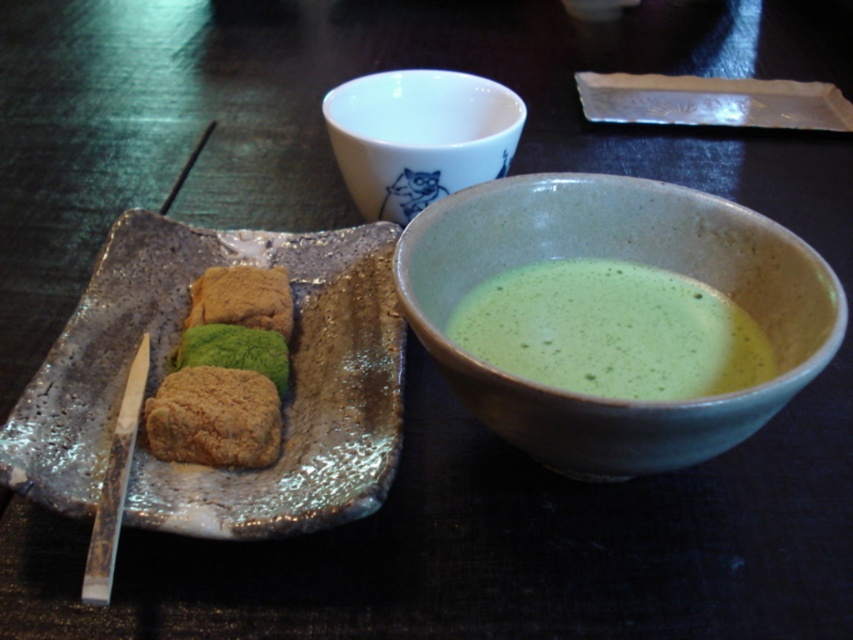
Question: Considering the real-world distances, which object is farthest from the matte ceramic bowl at center?

Choices:
 (A) brown crumbly pastry at center
 (B) green matte soup at center
 (C) white ceramic cup at upper center
 (D) green matte matcha tea cake at center

Answer: (C)

Question: Which point appears farthest from the camera in this image?

Choices:
 (A) (375, 269)
 (B) (585, 316)
 (C) (450, 100)
 (D) (247, 349)

Answer: (C)

Question: Can you confirm if matte ceramic bowl at center is thinner than green matte/soft sponge at center?

Choices:
 (A) no
 (B) yes

Answer: (A)

Question: Which of the following is the closest to the observer?

Choices:
 (A) green matte/soft sponge at center
 (B) green matte matcha tea cake at center
 (C) speckled ceramic platter at center-left

Answer: (C)

Question: Is white ceramic cup at upper center positioned at the back of brown crumbly pastry at center-left?

Choices:
 (A) no
 (B) yes

Answer: (B)

Question: Is green matte soup at center above brown crumbly pastry at center-left?

Choices:
 (A) yes
 (B) no

Answer: (A)